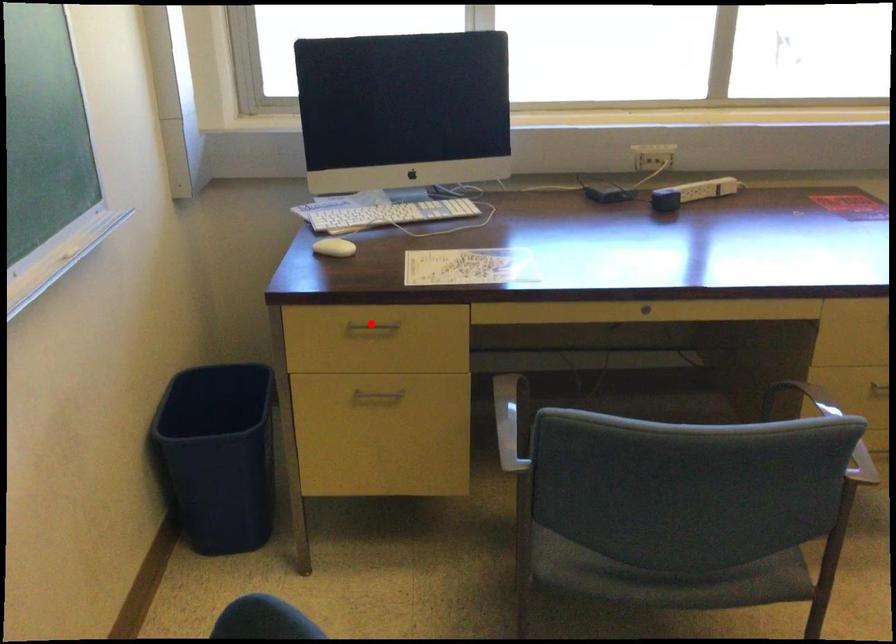
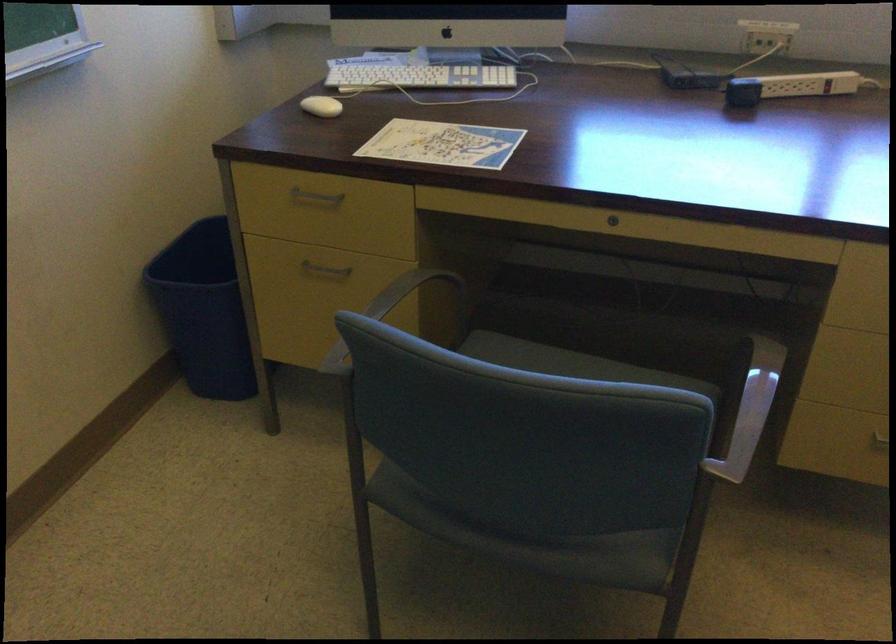
Where in the second image is the point corresponding to the highlighted location from the first image?

(315, 196)